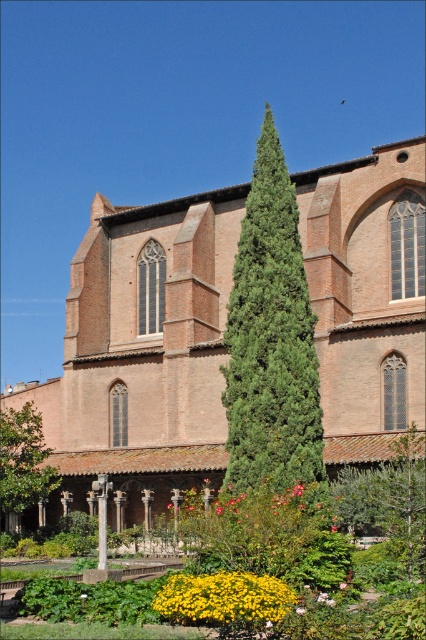
Question: Estimate the real-world distances between objects in this image. Which object is farther from the yellow matte flower at lower center?

Choices:
 (A) brick wall church at center
 (B) green leafy tree at lower left

Answer: (A)

Question: Does brick wall church at center have a smaller size compared to yellow matte flower at lower center?

Choices:
 (A) yes
 (B) no

Answer: (B)

Question: Can you confirm if brick wall church at center is positioned to the left of green leafy tree at lower left?

Choices:
 (A) yes
 (B) no

Answer: (A)

Question: Does green textured tree at center appear over green leafy tree at lower left?

Choices:
 (A) no
 (B) yes

Answer: (B)

Question: Estimate the real-world distances between objects in this image. Which object is farther from the brick wall church at center?

Choices:
 (A) yellow matte flower at lower center
 (B) green leafy tree at lower left
 (C) green textured tree at center

Answer: (A)

Question: Which point appears farthest from the camera in this image?

Choices:
 (A) (222, 612)
 (B) (40, 497)
 (C) (152, 419)

Answer: (C)